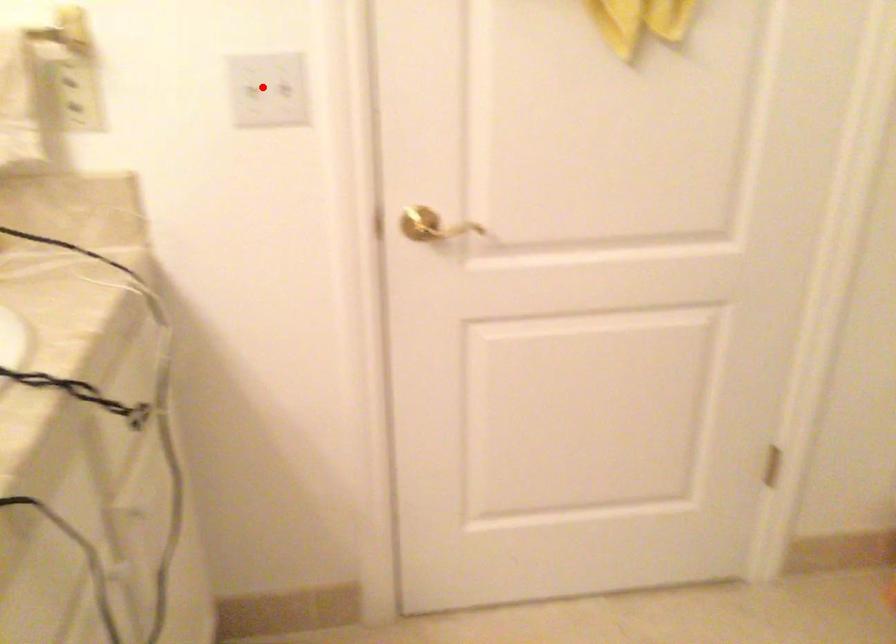
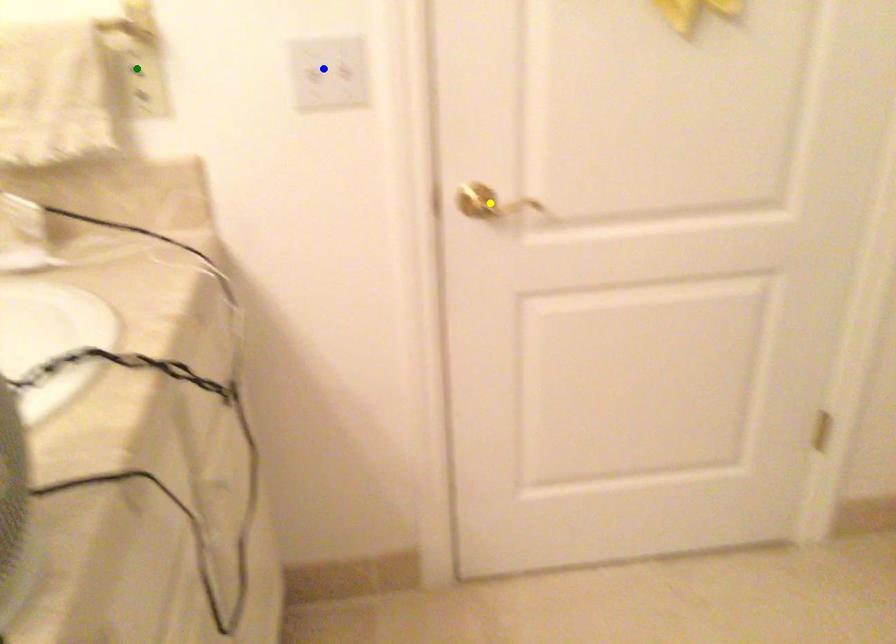
Question: I am providing you with two images of the same scene from different viewpoints. A red point is marked on the first image. You are given multiple points on the second image. Which point in image 2 is actually the same real-world point as the red point in image 1?

Choices:
 (A) yellow point
 (B) green point
 (C) blue point

Answer: (C)